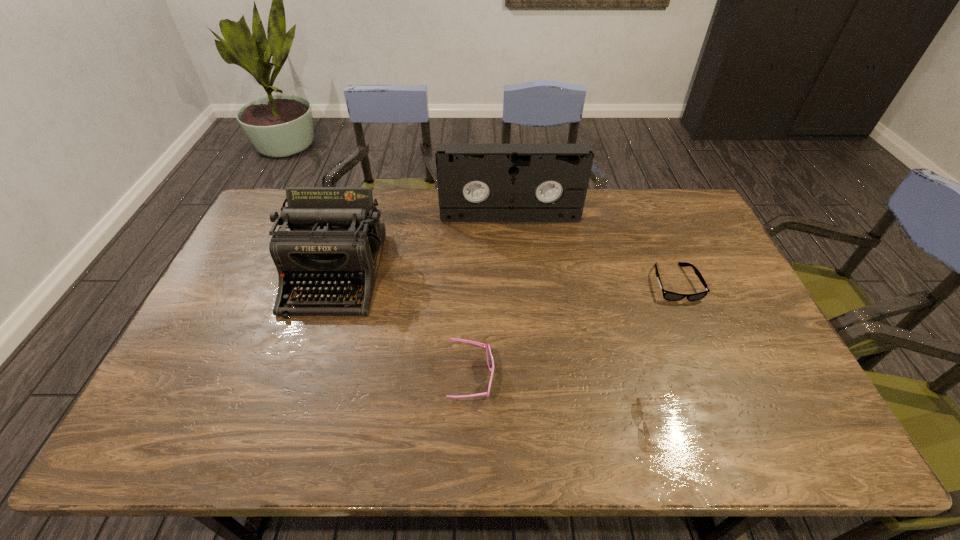
Find the location of a particular element. free region that satisfies the following two spatial constraints: 1. on the front-facing side of the second shortest object; 2. on the face of the shortest object is located at coordinates (734, 424).